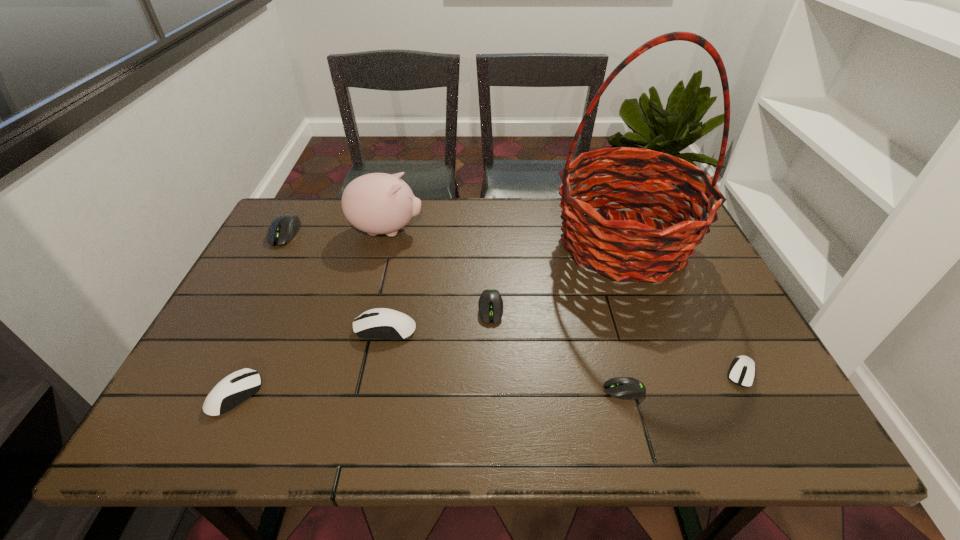
Image resolution: width=960 pixels, height=540 pixels. Find the location of `free space between the rightmost gray computer mouse and the second gray computer mouse from left to right`. free space between the rightmost gray computer mouse and the second gray computer mouse from left to right is located at coordinates (558, 349).

Locate an element on the screen. free space between the second biggest white mouse and the basket is located at coordinates (429, 319).

I want to click on empty space that is in between the seventh shortest object and the second gray computer mouse from right to left, so click(439, 269).

The image size is (960, 540). What are the coordinates of `free space that is in between the second nearest gray computer mouse and the rightmost white mouse` in the screenshot? It's located at (616, 341).

I want to click on free space that is in between the smallest white mouse and the piggy bank, so click(564, 302).

Identify the location of free space between the second biggest gray computer mouse and the smallest white mouse. (616, 341).

Where is `free area in between the second biggest white mouse and the basket`? The image size is (960, 540). free area in between the second biggest white mouse and the basket is located at coordinates (429, 319).

What are the coordinates of `the fifth closest object to the second biggest white mouse` in the screenshot? It's located at (654, 251).

I want to click on object that stands as the second closest to the rightmost white mouse, so click(654, 251).

Locate which computer mouse is the fourth closest to the nearest gray computer mouse. Please provide its 2D coordinates. Your answer should be formatted as a tuple, i.e. [(x, y)], where the tuple contains the x and y coordinates of a point satisfying the conditions above.

[(235, 388)]